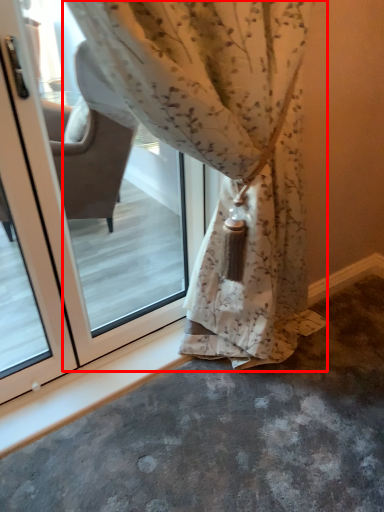
Question: From the image, what is the correct spatial relationship of curtain (annotated by the red box) in relation to screen door?

Choices:
 (A) right
 (B) left

Answer: (A)